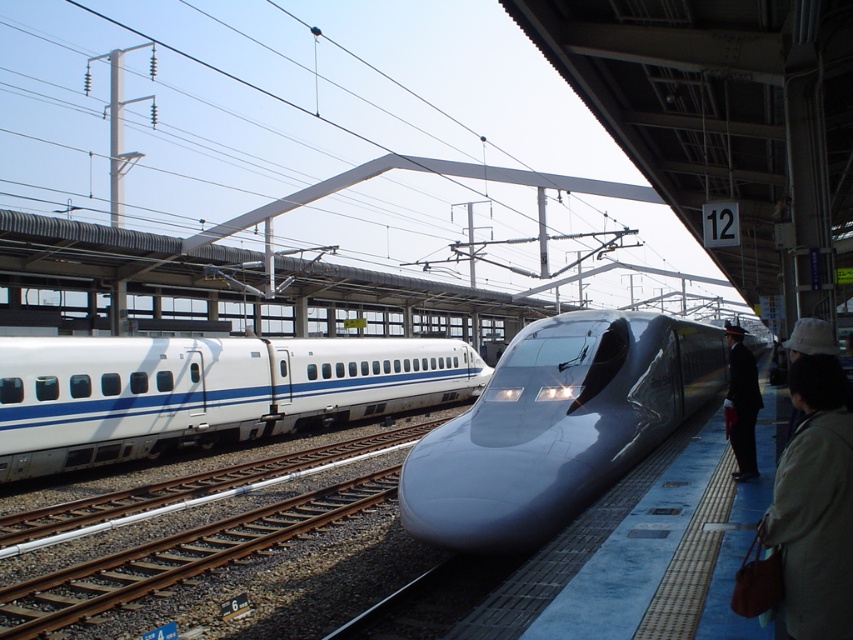
Based on the photo, you are a passenger waiting at the train station. You see the white glossy train at center and the beige fabric coat at lower right. Which object is positioned closer to the right side of the platform?

The beige fabric coat at lower right is positioned closer to the right side of the platform because the white glossy train at center is to the left of it.

You are a passenger waiting at the train station. You notice the glossy metallic train at center and the dark suit at platform right. Which object is taller?

The glossy metallic train at center is taller than the dark suit at platform right.